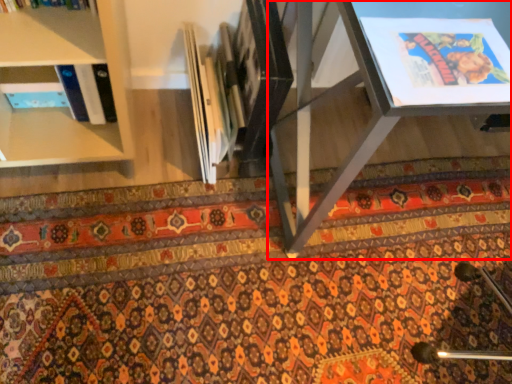
Question: From the image's perspective, considering the relative positions of table (annotated by the red box) and mat in the image provided, where is table (annotated by the red box) located with respect to the staircase?

Choices:
 (A) above
 (B) below

Answer: (A)